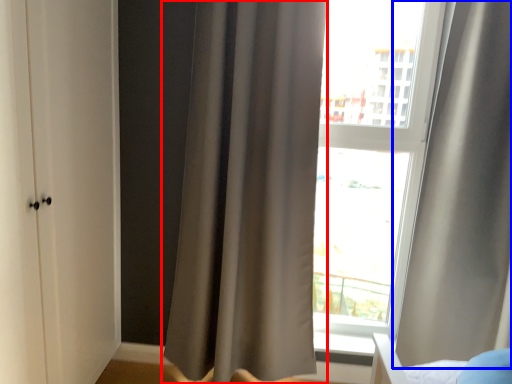
Question: Which point is closer to the camera, curtain (highlighted by a red box) or curtain (highlighted by a blue box)?

Choices:
 (A) curtain
 (B) curtain

Answer: (B)